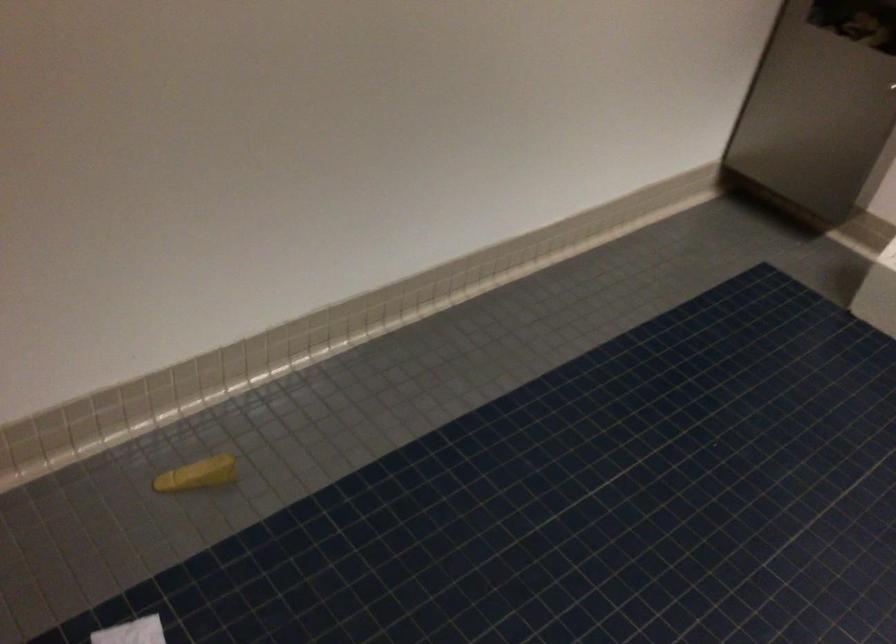
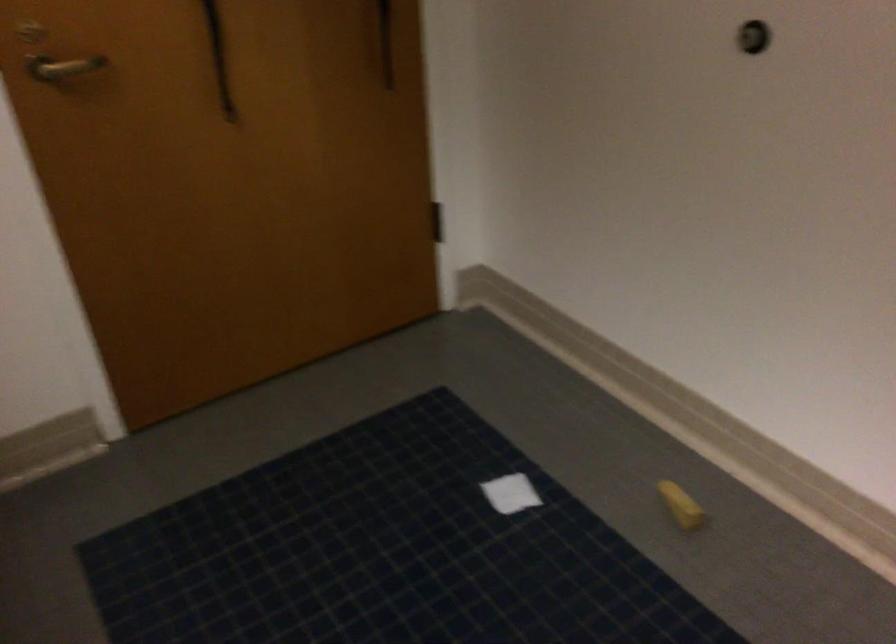
Find the pixel in the second image that matches (204,474) in the first image.

(681, 505)